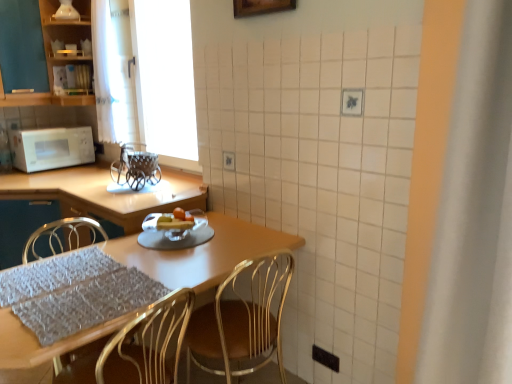
Question: Is white matte window screen at upper left to the right of gray textured placemat at lower left from the viewer's perspective?

Choices:
 (A) yes
 (B) no

Answer: (A)

Question: Does white matte window screen at upper left have a larger size compared to gray textured placemat at lower left?

Choices:
 (A) no
 (B) yes

Answer: (A)

Question: Is white matte window screen at upper left not near gray textured placemat at lower left?

Choices:
 (A) yes
 (B) no

Answer: (A)

Question: Is white matte window screen at upper left outside gray textured placemat at lower left?

Choices:
 (A) no
 (B) yes

Answer: (B)

Question: Is white matte window screen at upper left thinner than gray textured placemat at lower left?

Choices:
 (A) yes
 (B) no

Answer: (A)

Question: Choose the correct answer: Is metallic gold chair at center inside metallic basket at center or outside it?

Choices:
 (A) outside
 (B) inside

Answer: (A)

Question: From a real-world perspective, is metallic gold chair at center above or below metallic basket at center?

Choices:
 (A) below
 (B) above

Answer: (A)

Question: From the image's perspective, is metallic gold chair at center positioned above or below metallic basket at center?

Choices:
 (A) below
 (B) above

Answer: (A)

Question: In the image, is metallic gold chair at center on the left side or the right side of metallic basket at center?

Choices:
 (A) left
 (B) right

Answer: (B)

Question: Considering the positions of translucent glass fruit dish at center and metallic gold chair at center in the image, is translucent glass fruit dish at center taller or shorter than metallic gold chair at center?

Choices:
 (A) tall
 (B) short

Answer: (B)

Question: Based on their positions, is translucent glass fruit dish at center located to the left or right of metallic gold chair at center?

Choices:
 (A) left
 (B) right

Answer: (A)

Question: Looking at the image, does translucent glass fruit dish at center seem bigger or smaller compared to metallic gold chair at center?

Choices:
 (A) big
 (B) small

Answer: (B)

Question: Is point (172, 228) closer or farther from the camera than point (289, 266)?

Choices:
 (A) closer
 (B) farther

Answer: (A)

Question: Does point (31, 99) appear closer or farther from the camera than point (185, 228)?

Choices:
 (A) closer
 (B) farther

Answer: (B)

Question: From a real-world perspective, is matte black cabinet at upper left physically located above or below translucent glass fruit dish at center?

Choices:
 (A) below
 (B) above

Answer: (B)